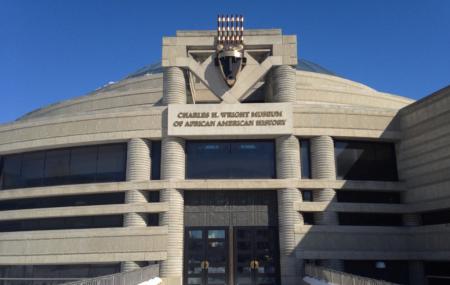
This screenshot has height=285, width=450. In order to click on right door in this screenshot , I will do `click(259, 251)`.